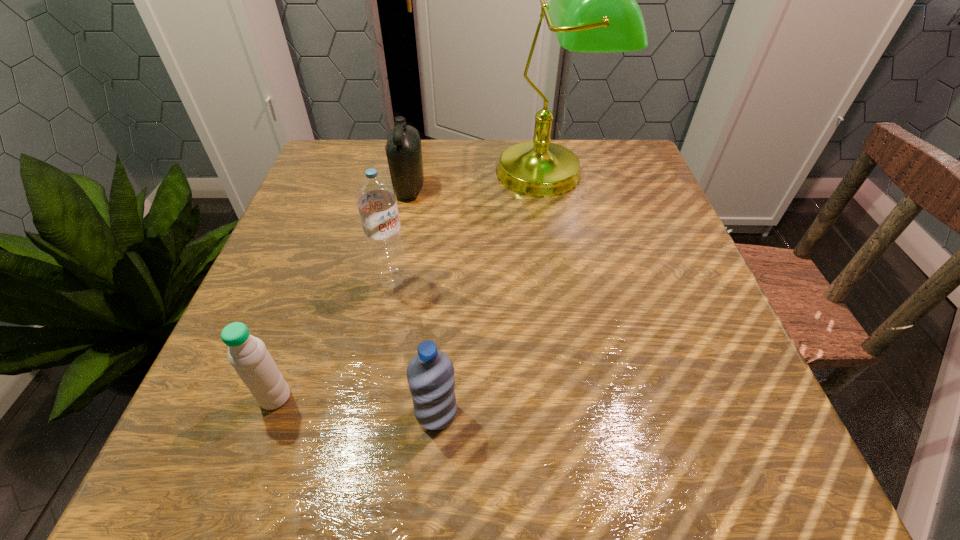
Image resolution: width=960 pixels, height=540 pixels. I want to click on vacant point located between the rightmost water bottle and the farthest water bottle, so click(415, 346).

Find the location of a particular element. The width and height of the screenshot is (960, 540). blank region between the leftmost object and the second water bottle from right to left is located at coordinates (334, 338).

At what (x,y) coordinates should I click in order to perform the action: click on free space between the leftmost object and the third nearest object. Please return your answer as a coordinate pair (x, y). Looking at the image, I should click on (334, 338).

The image size is (960, 540). What are the coordinates of `object that is the fourth nearest to the rightmost water bottle` in the screenshot? It's located at (403, 149).

Locate an element on the screen. The image size is (960, 540). object that is the fourth closest one to the bottle is located at coordinates (430, 374).

Identify which water bottle is the nearest to the tallest water bottle. Please provide its 2D coordinates. Your answer should be formatted as a tuple, i.e. [(x, y)], where the tuple contains the x and y coordinates of a point satisfying the conditions above.

[(248, 355)]

Identify which water bottle is located as the second nearest to the farthest water bottle. Please provide its 2D coordinates. Your answer should be formatted as a tuple, i.e. [(x, y)], where the tuple contains the x and y coordinates of a point satisfying the conditions above.

[(430, 374)]

You are a GUI agent. You are given a task and a screenshot of the screen. Output one action in this format:
    pyautogui.click(x=<x>, y=<y>)
    Task: Click on the vacant position in the image that satisfies the following two spatial constraints: 1. on the front side of the rightmost water bottle; 2. on the left side of the leftmost object
    The width and height of the screenshot is (960, 540).
    Given the screenshot: What is the action you would take?
    pyautogui.click(x=270, y=413)

You are a GUI agent. You are given a task and a screenshot of the screen. Output one action in this format:
    pyautogui.click(x=<x>, y=<y>)
    Task: Click on the vacant region that satisfies the following two spatial constraints: 1. on the front side of the bottle; 2. on the left side of the rightmost water bottle
    The height and width of the screenshot is (540, 960).
    Given the screenshot: What is the action you would take?
    pyautogui.click(x=366, y=413)